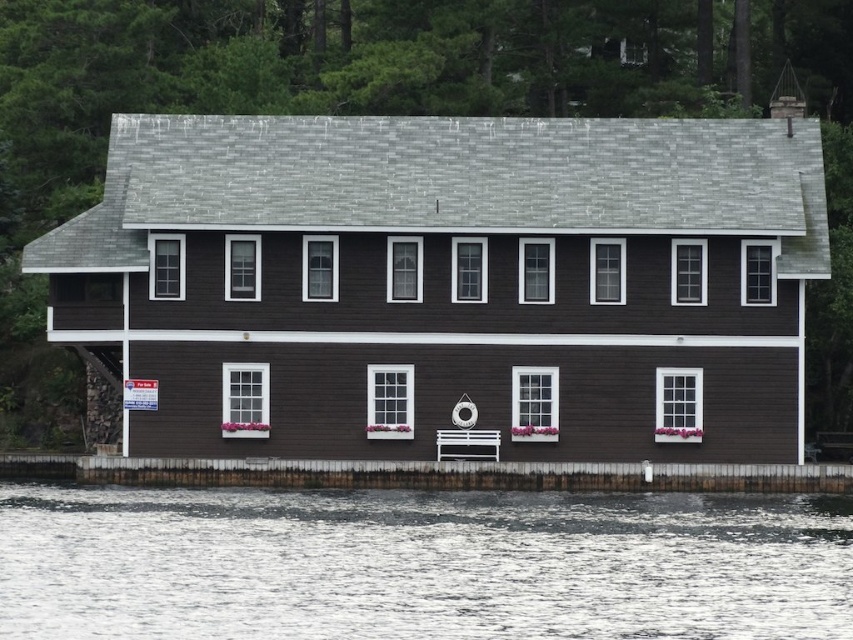
Question: Is clear water at lower center thinner than white wood dock at center?

Choices:
 (A) no
 (B) yes

Answer: (A)

Question: Does clear water at lower center have a lesser width compared to white wood dock at center?

Choices:
 (A) yes
 (B) no

Answer: (B)

Question: Which point is closer to the camera taking this photo?

Choices:
 (A) (21, 540)
 (B) (454, 444)

Answer: (A)

Question: Which point is closer to the camera?

Choices:
 (A) (473, 440)
 (B) (189, 520)

Answer: (B)

Question: Is clear water at lower center closer to the viewer compared to white wood dock at center?

Choices:
 (A) yes
 (B) no

Answer: (A)